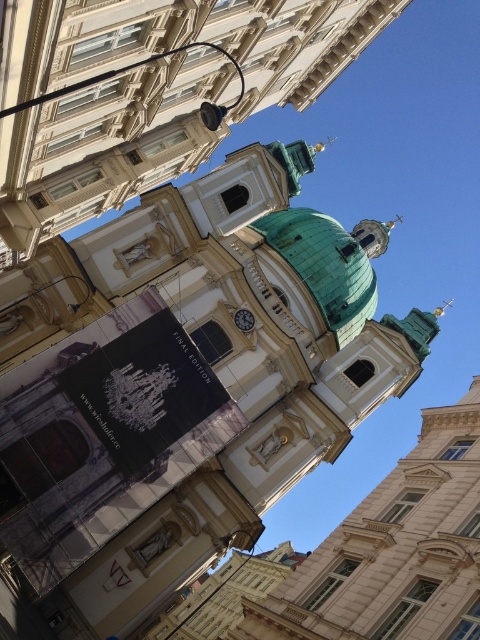
Can you confirm if green dome at center is smaller than white glossy clock at center?

No, green dome at center is not smaller than white glossy clock at center.

Does green dome at center appear under white glossy clock at center?

Actually, green dome at center is above white glossy clock at center.

Which is in front, point (184, 104) or point (243, 314)?

Point (184, 104)

The height and width of the screenshot is (640, 480). I want to click on green dome at center, so click(x=148, y=90).

Does green dome at center lie in front of green copper dome at center?

Yes, it is.

Which is more to the right, green dome at center or green copper dome at center?

From the viewer's perspective, green copper dome at center appears more on the right side.

Locate an element on the screen. green dome at center is located at coordinates (148, 90).

Does green copper dome at center come behind white glossy clock at center?

Yes, it is behind white glossy clock at center.

Does point (374, 298) lie behind point (238, 323)?

That is True.

At what (x,y) coordinates should I click in order to perform the action: click on green copper dome at center. Please return your answer as a coordinate pair (x, y). The width and height of the screenshot is (480, 640). Looking at the image, I should click on point(325,266).